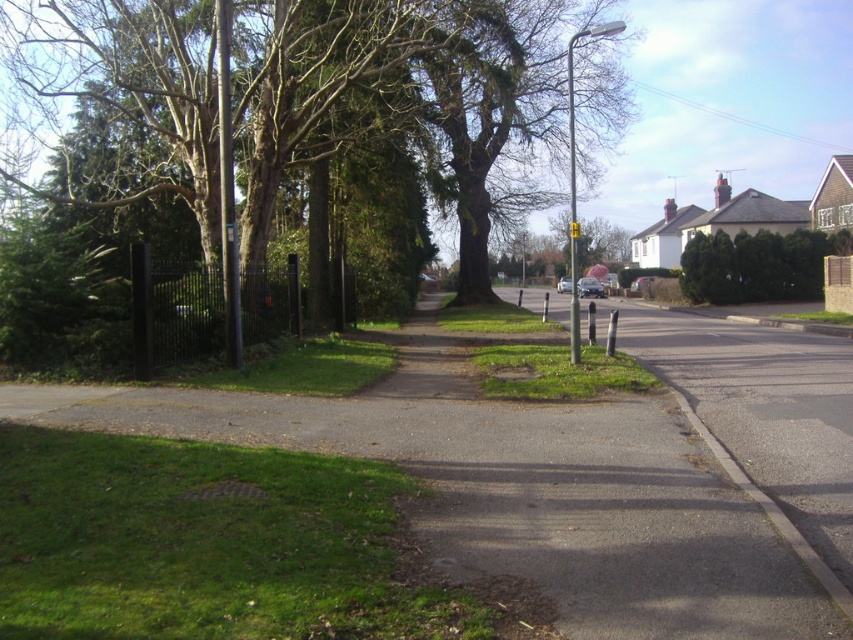
Question: Among these objects, which one is nearest to the camera?

Choices:
 (A) green leafy tree at upper right
 (B) gravel path at center

Answer: (B)

Question: Observing the image, what is the correct spatial positioning of green leafy tree at center in reference to green leafy tree at upper right?

Choices:
 (A) below
 (B) above

Answer: (B)

Question: Considering the real-world distances, which object is closest to the green leafy tree at upper right?

Choices:
 (A) gravel path at center
 (B) green leafy tree at center

Answer: (B)

Question: Which object is the farthest from the green leafy tree at center?

Choices:
 (A) gravel path at center
 (B) green leafy tree at upper right

Answer: (B)

Question: Is gravel path at center closer to camera compared to green leafy tree at center?

Choices:
 (A) yes
 (B) no

Answer: (A)

Question: Can you confirm if gravel path at center is thinner than green leafy tree at upper right?

Choices:
 (A) yes
 (B) no

Answer: (B)